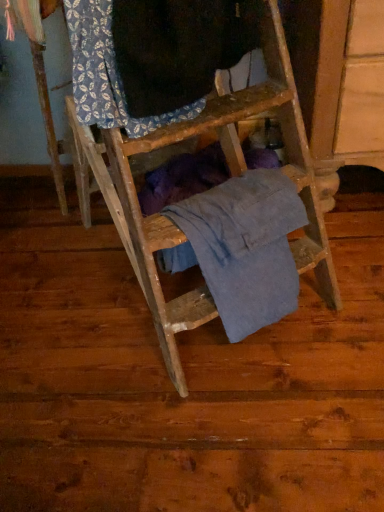
Question: Is blue cotton shirt at center, the 1th clothing from the bottom, further to the viewer compared to blue printed fabric at upper left, placed as the 2th clothing when sorted from bottom to top?

Choices:
 (A) yes
 (B) no

Answer: (A)

Question: Is blue cotton shirt at center, the second clothing when ordered from top to bottom, positioned beyond the bounds of blue printed fabric at upper left, which is the 1th clothing from top to bottom?

Choices:
 (A) no
 (B) yes

Answer: (B)

Question: From the image's perspective, does blue cotton shirt at center, the second clothing when ordered from top to bottom, appear higher than blue printed fabric at upper left, which is the 1th clothing from top to bottom?

Choices:
 (A) yes
 (B) no

Answer: (B)

Question: Is blue cotton shirt at center, the second clothing when ordered from top to bottom, facing towards blue printed fabric at upper left, which is the 1th clothing from top to bottom?

Choices:
 (A) yes
 (B) no

Answer: (B)

Question: From a real-world perspective, is blue cotton shirt at center, the second clothing when ordered from top to bottom, physically below blue printed fabric at upper left, which is the 1th clothing from top to bottom?

Choices:
 (A) yes
 (B) no

Answer: (A)

Question: Is blue cotton shirt at center, the second clothing when ordered from top to bottom, positioned with its back to blue printed fabric at upper left, placed as the 2th clothing when sorted from bottom to top?

Choices:
 (A) yes
 (B) no

Answer: (B)

Question: Is blue printed fabric at upper left, which is the 1th clothing from top to bottom, behind blue cotton shirt at center, the 1th clothing from the bottom?

Choices:
 (A) no
 (B) yes

Answer: (A)

Question: Is blue printed fabric at upper left, placed as the 2th clothing when sorted from bottom to top, positioned far away from blue cotton shirt at center, the second clothing when ordered from top to bottom?

Choices:
 (A) no
 (B) yes

Answer: (A)

Question: Is blue printed fabric at upper left, which is the 1th clothing from top to bottom, facing away from blue cotton shirt at center, the second clothing when ordered from top to bottom?

Choices:
 (A) no
 (B) yes

Answer: (A)

Question: From a real-world perspective, is blue printed fabric at upper left, placed as the 2th clothing when sorted from bottom to top, physically below blue cotton shirt at center, the 1th clothing from the bottom?

Choices:
 (A) yes
 (B) no

Answer: (B)

Question: Can you confirm if blue printed fabric at upper left, which is the 1th clothing from top to bottom, is wider than blue cotton shirt at center, the 1th clothing from the bottom?

Choices:
 (A) no
 (B) yes

Answer: (B)

Question: Considering the relative positions of blue printed fabric at upper left, placed as the 2th clothing when sorted from bottom to top, and blue cotton shirt at center, the second clothing when ordered from top to bottom, in the image provided, is blue printed fabric at upper left, placed as the 2th clothing when sorted from bottom to top, in front of blue cotton shirt at center, the second clothing when ordered from top to bottom,?

Choices:
 (A) no
 (B) yes

Answer: (B)

Question: Do you think blue printed fabric at upper left, which is the 1th clothing from top to bottom, is within blue cotton shirt at center, the second clothing when ordered from top to bottom, or outside of it?

Choices:
 (A) inside
 (B) outside

Answer: (B)